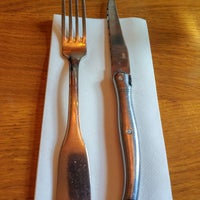
Where is `napkin`? napkin is located at coordinates (136, 45).